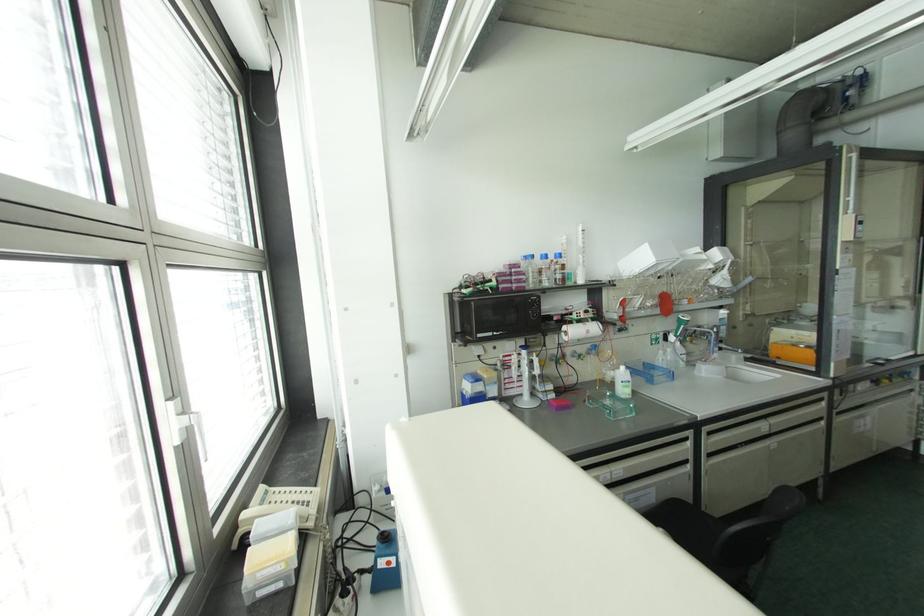
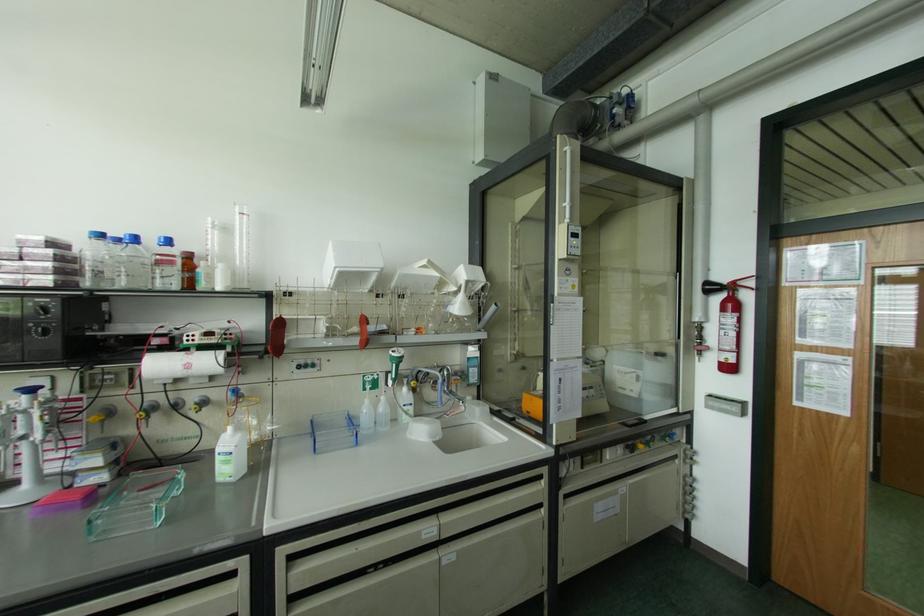
The point at (660, 352) is marked in the first image. Where is the corresponding point in the second image?

(367, 400)